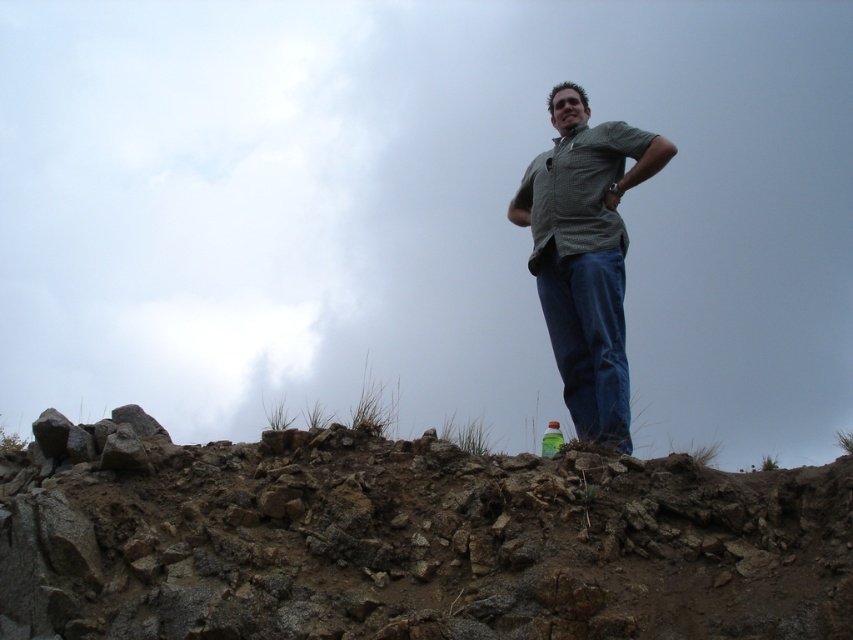
Question: Which is farther from the checkered fabric shirt at center?

Choices:
 (A) rough stone hillside at center
 (B) blue denim jeans at center

Answer: (A)

Question: Based on their relative distances, which object is nearer to the blue denim jeans at center?

Choices:
 (A) rough stone hillside at center
 (B) checkered fabric shirt at center

Answer: (B)

Question: Does rough stone hillside at center have a smaller size compared to checkered fabric shirt at center?

Choices:
 (A) yes
 (B) no

Answer: (B)

Question: Is rough stone hillside at center closer to the viewer compared to blue denim jeans at center?

Choices:
 (A) no
 (B) yes

Answer: (B)

Question: Can you confirm if checkered fabric shirt at center is positioned to the left of green plastic bottle at center?

Choices:
 (A) no
 (B) yes

Answer: (A)

Question: Which object is positioned farthest from the green plastic bottle at center?

Choices:
 (A) rough stone hillside at center
 (B) checkered fabric shirt at center
 (C) blue denim jeans at center

Answer: (A)